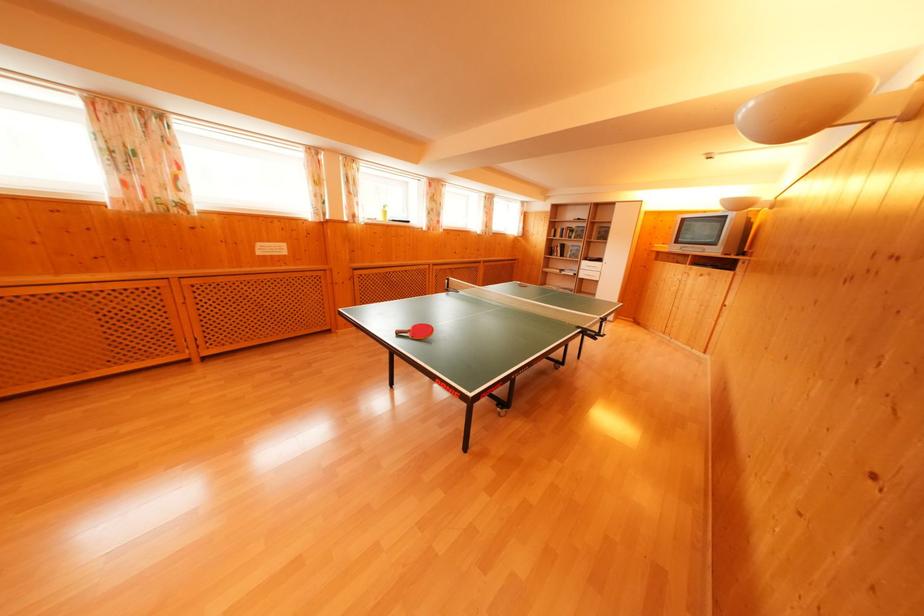
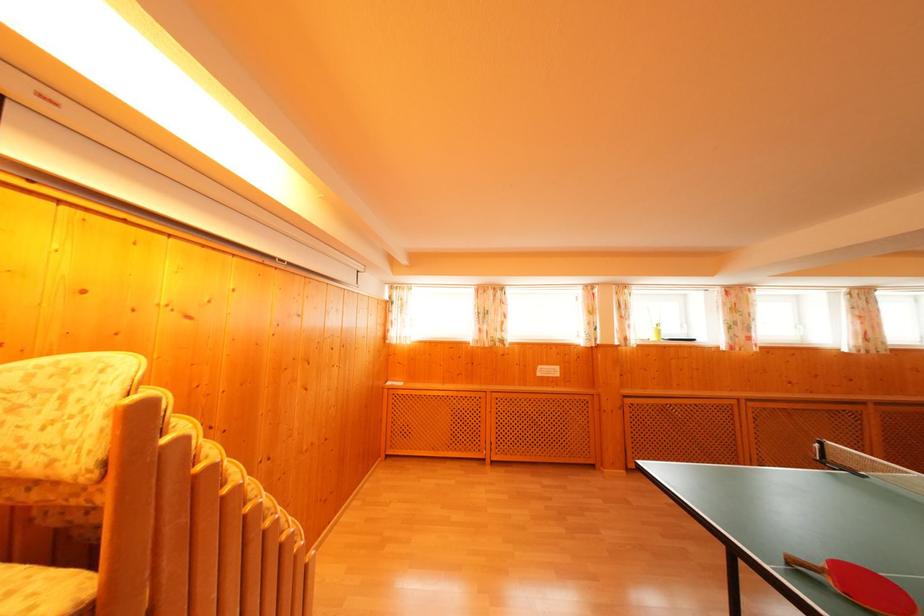
Where in the second image is the point corresponding to (x=450, y=288) from the first image?

(817, 453)